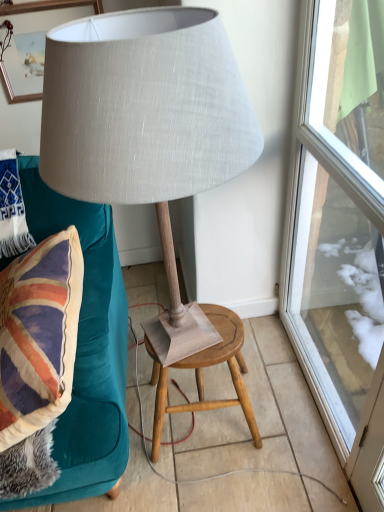
The height and width of the screenshot is (512, 384). I want to click on free space to the left of wooden stool at center, so click(x=135, y=423).